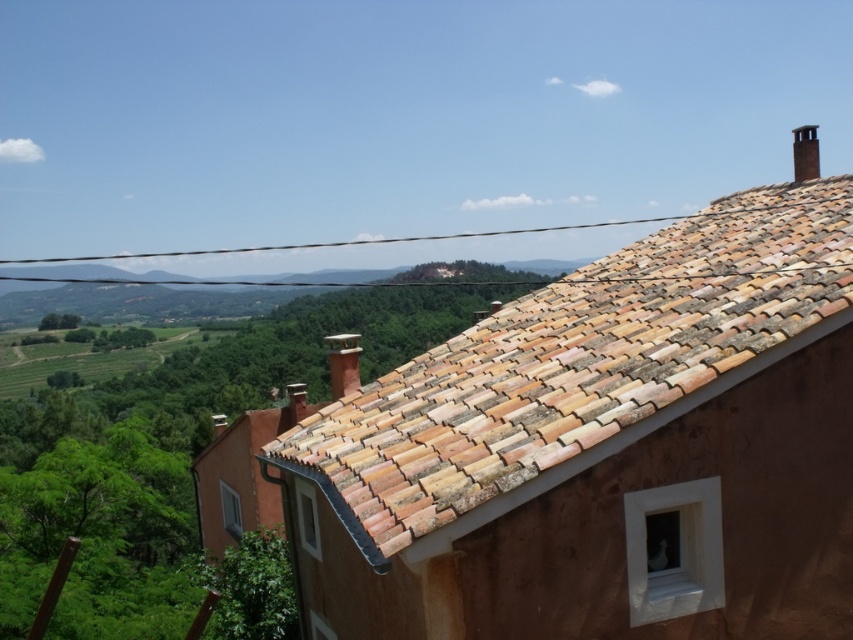
You are standing in the rural landscape scene and want to place a small decorative statue exactly halfway between point (448, 472) and point (817, 164). Based on the spatial relationship between these two points, will the statue be closer to the foreground or the background of the image?

The statue will be closer to the foreground because point (448, 472) is closer to the viewer than point (817, 164). Since the halfway point between them would be closer to the foreground point, the statue will be nearer to the foreground than the background.

You are a drone operator tasked with capturing aerial footage of the terracotta tiles at upper right and the black brick chimney at upper right. Your drone has a maximum camera range of 7 meters. Can you capture both objects in a single shot without moving the drone?

The terracotta tiles at upper right and the black brick chimney at upper right are 7.10 meters apart from each other. Since the drone has a maximum camera range of 7 meters, the distance between them exceeds the camera range by 0.10 meters. Therefore, you cannot capture both objects in a single shot without moving the drone.